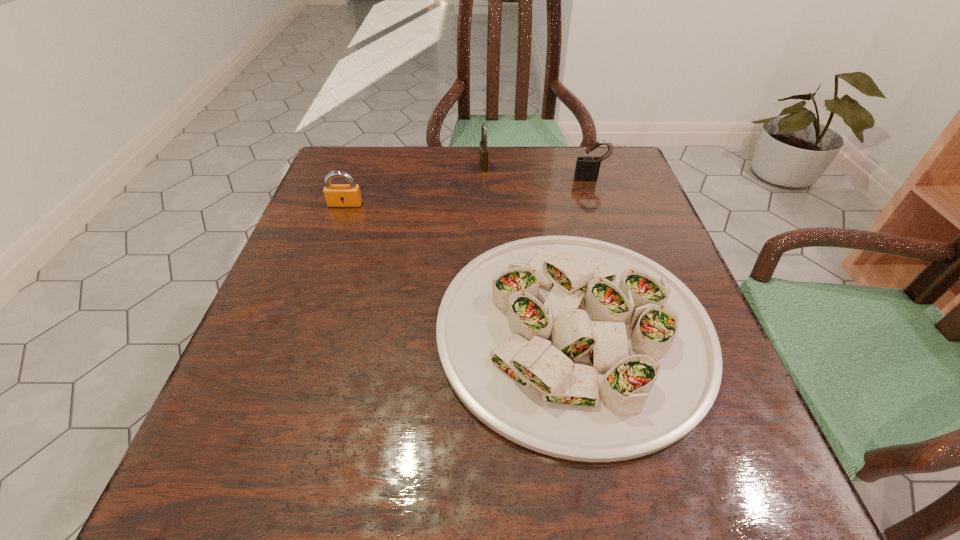
At what (x,y) coordinates should I click in order to perform the action: click on the farthest object. Please return your answer as a coordinate pair (x, y). This screenshot has height=540, width=960. Looking at the image, I should click on (483, 147).

This screenshot has height=540, width=960. I want to click on the second padlock from left to right, so click(x=483, y=147).

Image resolution: width=960 pixels, height=540 pixels. In order to click on the second nearest padlock in this screenshot , I will do `click(587, 168)`.

This screenshot has height=540, width=960. I want to click on the rightmost padlock, so click(x=587, y=168).

Identify the location of the shortest padlock. (337, 195).

Identify the location of the nearest padlock. (337, 195).

Where is `the nearest object`? the nearest object is located at coordinates (576, 348).

Find the location of a particular element. The width and height of the screenshot is (960, 540). platter is located at coordinates (576, 348).

Locate an element on the screen. free location located on the right of the farthest object is located at coordinates (520, 166).

You are a GUI agent. You are given a task and a screenshot of the screen. Output one action in this format:
    pyautogui.click(x=<x>, y=<y>)
    Task: Click on the vacant area located 0.130m with the keyhole on the front of the third nearest object
    This screenshot has width=960, height=540.
    Given the screenshot: What is the action you would take?
    pyautogui.click(x=602, y=213)